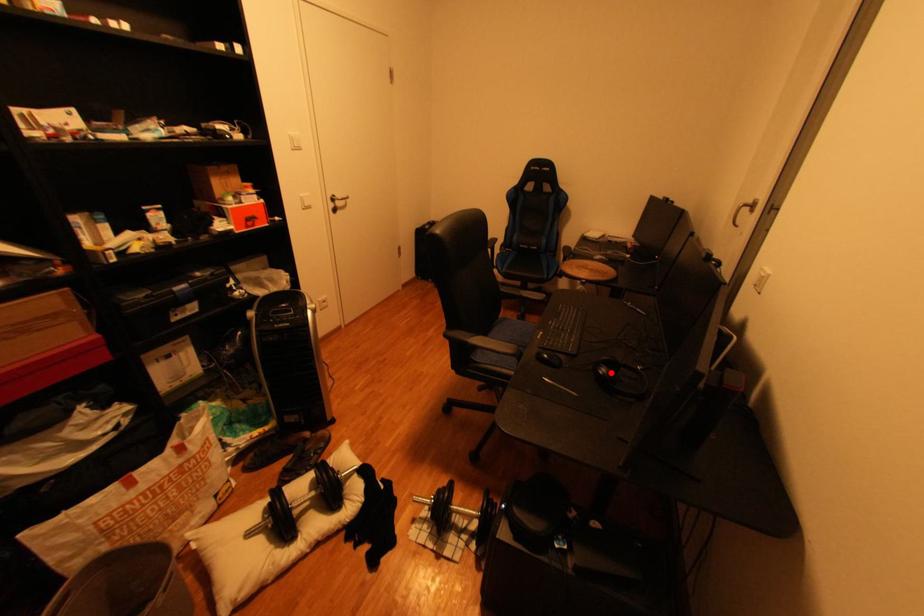
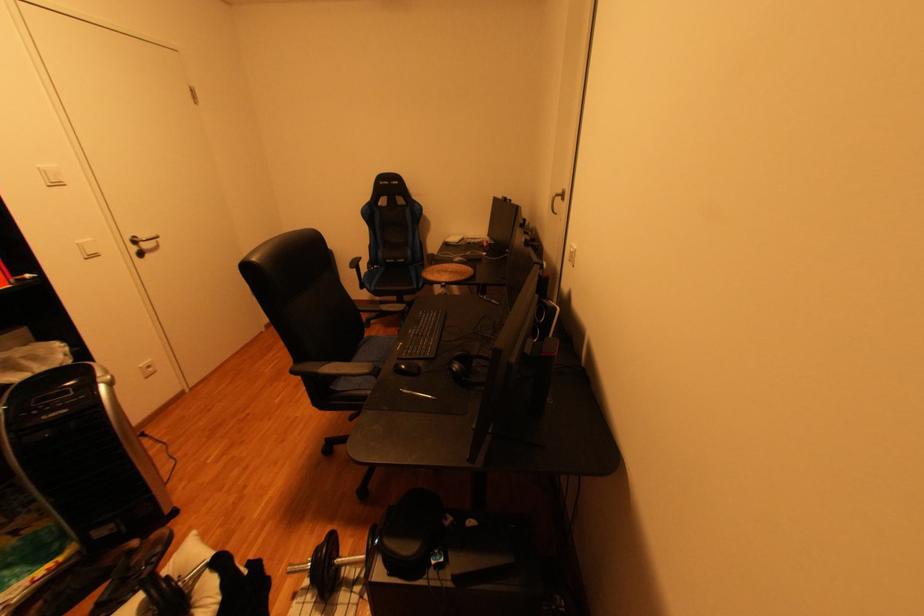
Where in the second image is the point corresponding to the highlighted location from the first image?

(464, 370)